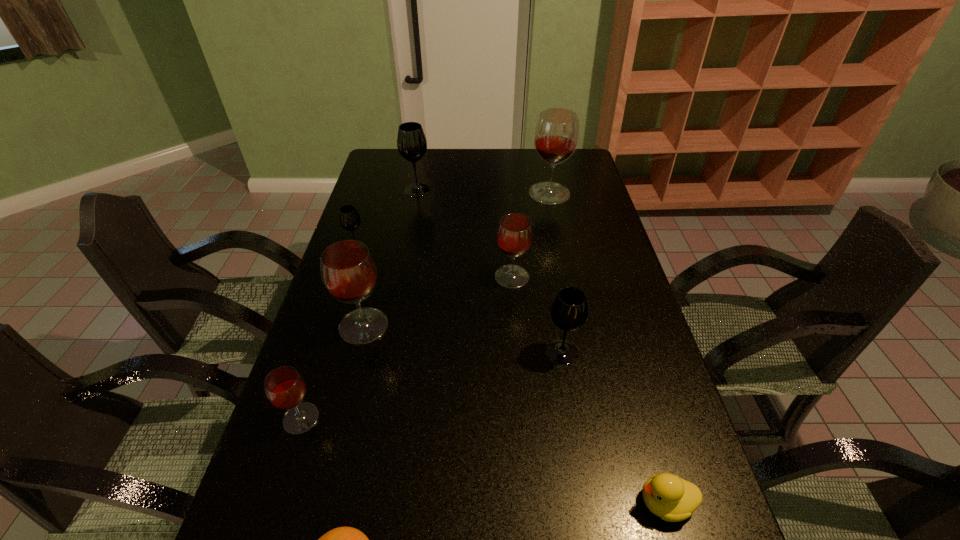
You are a GUI agent. You are given a task and a screenshot of the screen. Output one action in this format:
    pyautogui.click(x=<x>, y=<y>)
    Task: Click on the leftmost gray wineglass
    Image resolution: width=960 pixels, height=540 pixels.
    Given the screenshot: What is the action you would take?
    pyautogui.click(x=349, y=218)

You are a GUI agent. You are given a task and a screenshot of the screen. Output one action in this format:
    pyautogui.click(x=<x>, y=<y>)
    Task: Click on the smallest red wineglass
    Image resolution: width=960 pixels, height=540 pixels.
    Given the screenshot: What is the action you would take?
    pyautogui.click(x=285, y=388)

At what (x,y) coordinates should I click in order to perform the action: click on the seventh farthest object. Please return your answer as a coordinate pair (x, y). The image size is (960, 540). Looking at the image, I should click on (285, 388).

Identify the location of duckling. The image size is (960, 540). (673, 499).

The width and height of the screenshot is (960, 540). I want to click on yellow duckling, so click(x=673, y=499).

At what (x,y) coordinates should I click in order to perform the action: click on free location located 0.150m on the left of the rightmost red wineglass. Please return your answer as a coordinate pair (x, y). Looking at the image, I should click on (490, 193).

I want to click on free space located on the left of the second gray wineglass from right to left, so click(x=374, y=190).

The width and height of the screenshot is (960, 540). I want to click on vacant point located 0.270m on the right of the second biggest red wineglass, so click(x=488, y=326).

You are a GUI agent. You are given a task and a screenshot of the screen. Output one action in this format:
    pyautogui.click(x=<x>, y=<y>)
    Task: Click on the free space located 0.310m on the back of the fifth wineglass from left to right
    This screenshot has width=960, height=540.
    Given the screenshot: What is the action you would take?
    pyautogui.click(x=507, y=209)

The image size is (960, 540). Find the location of `vacant space situated on the left of the nearest gray wineglass`. vacant space situated on the left of the nearest gray wineglass is located at coordinates coord(456,352).